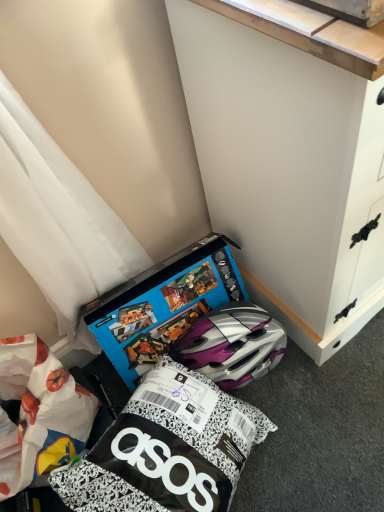
Question: Is blue cardboard box at lower center shorter than white painted wood cabinet at lower right?

Choices:
 (A) yes
 (B) no

Answer: (A)

Question: Could you tell me if blue cardboard box at lower center is turned towards white painted wood cabinet at lower right?

Choices:
 (A) yes
 (B) no

Answer: (B)

Question: Does blue cardboard box at lower center appear on the right side of white painted wood cabinet at lower right?

Choices:
 (A) yes
 (B) no

Answer: (B)

Question: Are blue cardboard box at lower center and white painted wood cabinet at lower right far apart?

Choices:
 (A) yes
 (B) no

Answer: (B)

Question: Is blue cardboard box at lower center not inside white painted wood cabinet at lower right?

Choices:
 (A) yes
 (B) no

Answer: (A)

Question: From the image's perspective, is blue cardboard box at lower center on white painted wood cabinet at lower right?

Choices:
 (A) no
 (B) yes

Answer: (A)

Question: Can you confirm if white painted wood cabinet at lower right is bigger than blue cardboard box at lower center?

Choices:
 (A) no
 (B) yes

Answer: (B)

Question: Is white painted wood cabinet at lower right not close to blue cardboard box at lower center?

Choices:
 (A) no
 (B) yes

Answer: (A)

Question: Is blue cardboard box at lower center inside white painted wood cabinet at lower right?

Choices:
 (A) yes
 (B) no

Answer: (B)

Question: Is white painted wood cabinet at lower right positioned behind blue cardboard box at lower center?

Choices:
 (A) no
 (B) yes

Answer: (A)

Question: From a real-world perspective, is white painted wood cabinet at lower right physically above blue cardboard box at lower center?

Choices:
 (A) yes
 (B) no

Answer: (A)

Question: Can you confirm if white painted wood cabinet at lower right is shorter than blue cardboard box at lower center?

Choices:
 (A) yes
 (B) no

Answer: (B)

Question: Based on their positions, is white painted wood cabinet at lower right located to the left or right of blue cardboard box at lower center?

Choices:
 (A) left
 (B) right

Answer: (B)